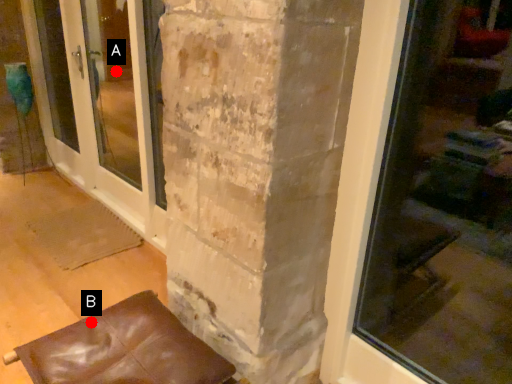
Question: Two points are circled on the image, labeled by A and B beside each circle. Which point appears farthest from the camera in this image?

Choices:
 (A) A is further
 (B) B is further

Answer: (A)